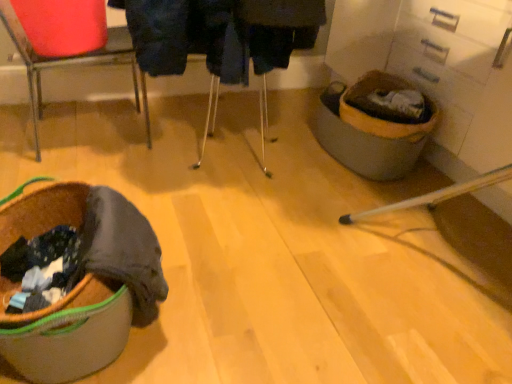
Where is `free space to the back side of brown fabric laundry basket at lower left`? Image resolution: width=512 pixels, height=384 pixels. free space to the back side of brown fabric laundry basket at lower left is located at coordinates (x=166, y=198).